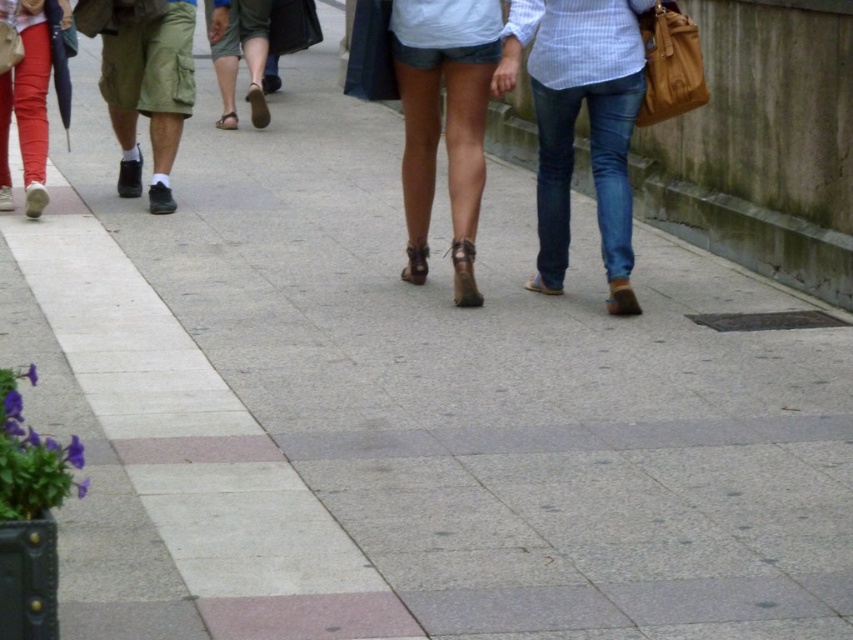
You are a pedestrian on the sidewalk and see the denim shorts at center and the matte red pants at left. Which one is closer to your right side?

The denim shorts at center is to the right of matte red pants at left, so the denim shorts at center is closer to your right side.

You are standing on the sidewalk and see the denim shorts at center. If you want to reach them in 3 seconds, what is the minimum speed you need to walk towards them?

The denim shorts at center are 24.17 feet away. To cover this distance in 3 seconds, you would need to walk at a speed of approximately 8.06 feet per second.